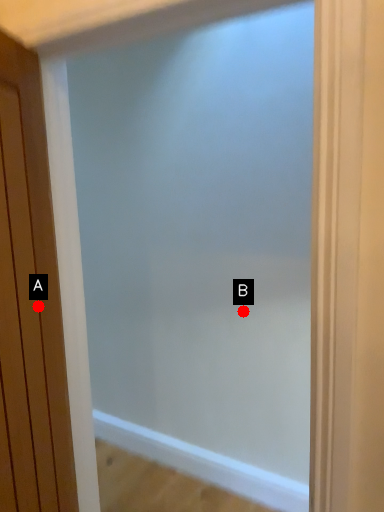
Question: Two points are circled on the image, labeled by A and B beside each circle. Which point is closer to the camera?

Choices:
 (A) A is closer
 (B) B is closer

Answer: (A)